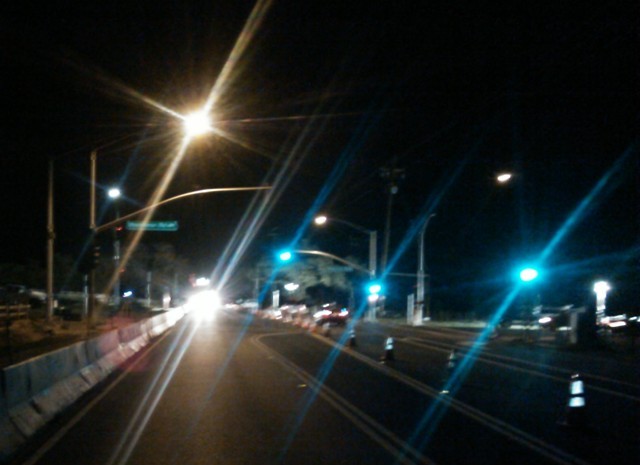
Locate an element on the screen. This screenshot has width=640, height=465. beige light is located at coordinates (198, 118).